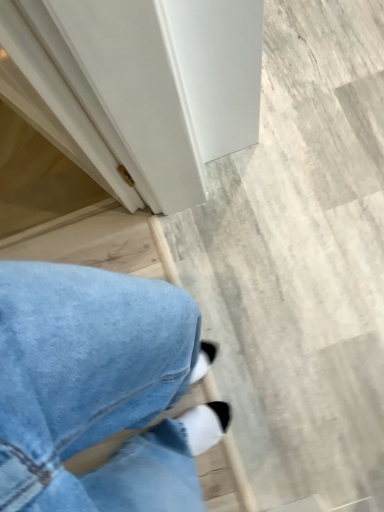
Question: Should I look upward or downward to see white matte stairwell at center?

Choices:
 (A) up
 (B) down

Answer: (A)